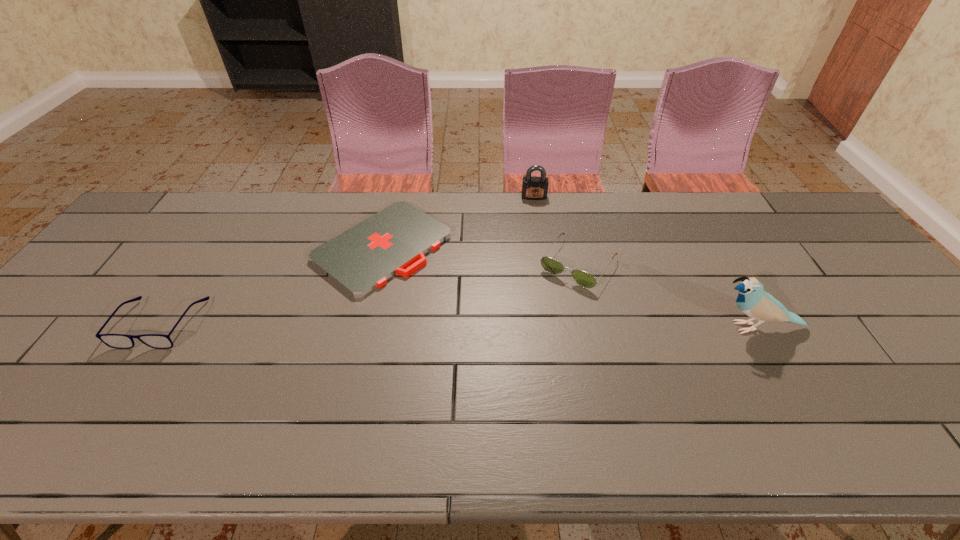
Identify the location of free space on the desktop that is between the leftmost object and the rightmost object and is positioned on the front-facing side of the sunglasses. coord(534,326).

Image resolution: width=960 pixels, height=540 pixels. I want to click on free space on the desktop that is between the spectacles and the bird and is positioned on the front of the farthest object near the keyhole, so click(542, 326).

Locate an element on the screen. This screenshot has width=960, height=540. vacant space on the desktop that is between the spectacles and the bird and is positioned on handle side the fourth object from right to left is located at coordinates (498, 326).